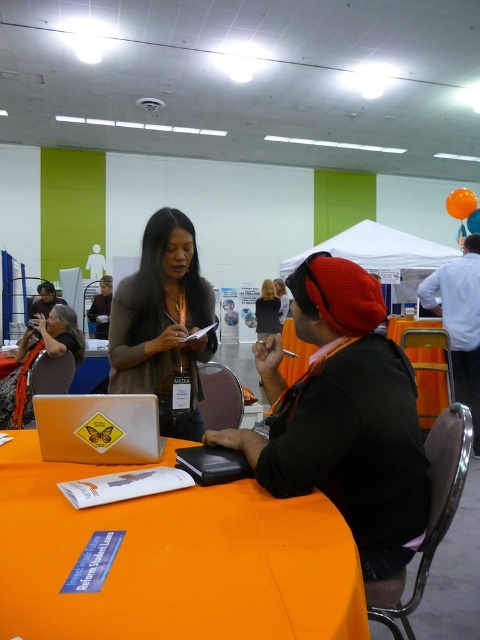
Which of these two, matte black jacket at center or yellow matte laptop at center, stands shorter?

yellow matte laptop at center is shorter.

Does point (123, 314) lie in front of point (145, 419)?

That is False.

Is point (191, 282) in front of point (46, 403)?

No, it is behind (46, 403).

Where is `matte black jacket at center`? matte black jacket at center is located at coordinates (164, 323).

Does orange fabric table at center have a lesser height compared to matte orange scarf at center?

Yes, orange fabric table at center is shorter than matte orange scarf at center.

Does orange fabric table at center appear over matte orange scarf at center?

Actually, orange fabric table at center is below matte orange scarf at center.

Is point (331, 632) positioned in front of point (20, 353)?

That is True.

Locate an element on the screen. The image size is (480, 640). orange fabric table at center is located at coordinates (172, 561).

Does orange fabric table at center appear over matte black jacket at center?

No, orange fabric table at center is not above matte black jacket at center.

Where is `orange fabric table at center`? The height and width of the screenshot is (640, 480). orange fabric table at center is located at coordinates (172, 561).

Locate an element on the screen. This screenshot has height=640, width=480. orange fabric table at center is located at coordinates (172, 561).